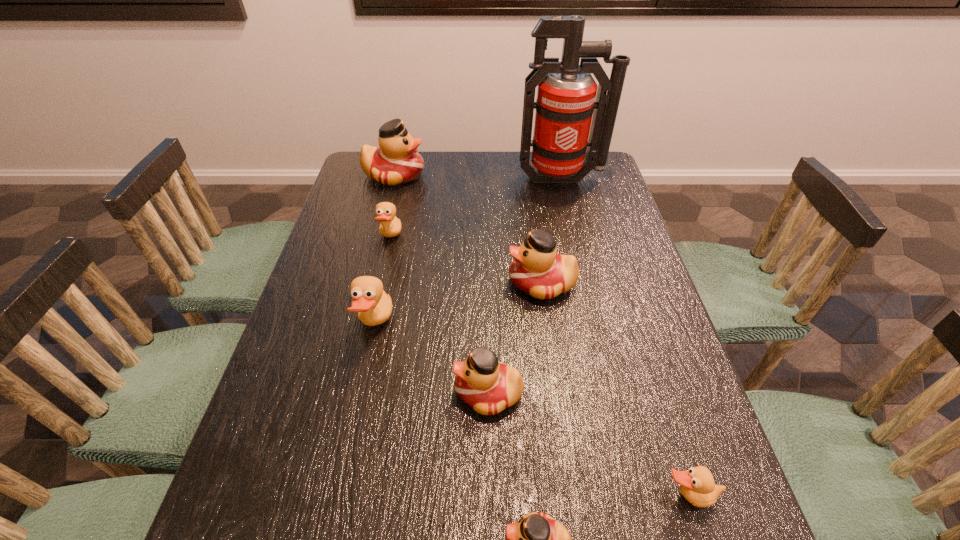
The height and width of the screenshot is (540, 960). In order to click on the tallest object in this screenshot , I will do `click(566, 94)`.

At what (x,y) coordinates should I click in order to perform the action: click on red fire extinguisher. Please return your answer as a coordinate pair (x, y). The height and width of the screenshot is (540, 960). Looking at the image, I should click on (566, 94).

Identify the location of the farthest duck. (396, 161).

I want to click on the second tallest object, so click(396, 161).

Identify the location of the second farthest red duck. This screenshot has width=960, height=540. (537, 270).

I want to click on the second nearest tan duck, so point(374,306).

Where is `the second smallest red duck`? the second smallest red duck is located at coordinates (488, 386).

Image resolution: width=960 pixels, height=540 pixels. Identify the location of the fifth farthest duck. (488, 386).

At what (x,y) coordinates should I click in order to perform the action: click on the second biggest tan duck. Please return your answer as a coordinate pair (x, y). Looking at the image, I should click on (390, 226).

Where is `the farthest tan duck`? The image size is (960, 540). the farthest tan duck is located at coordinates (390, 226).